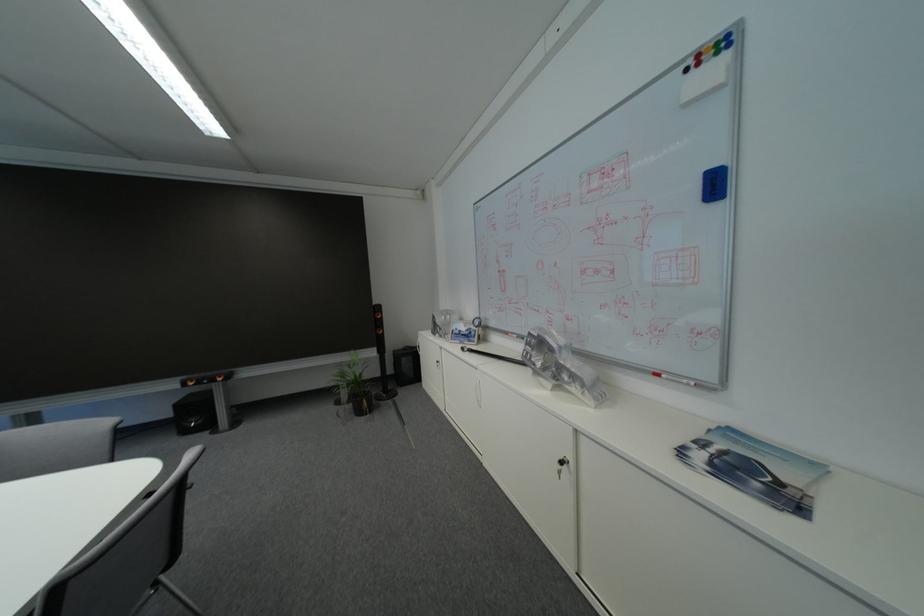
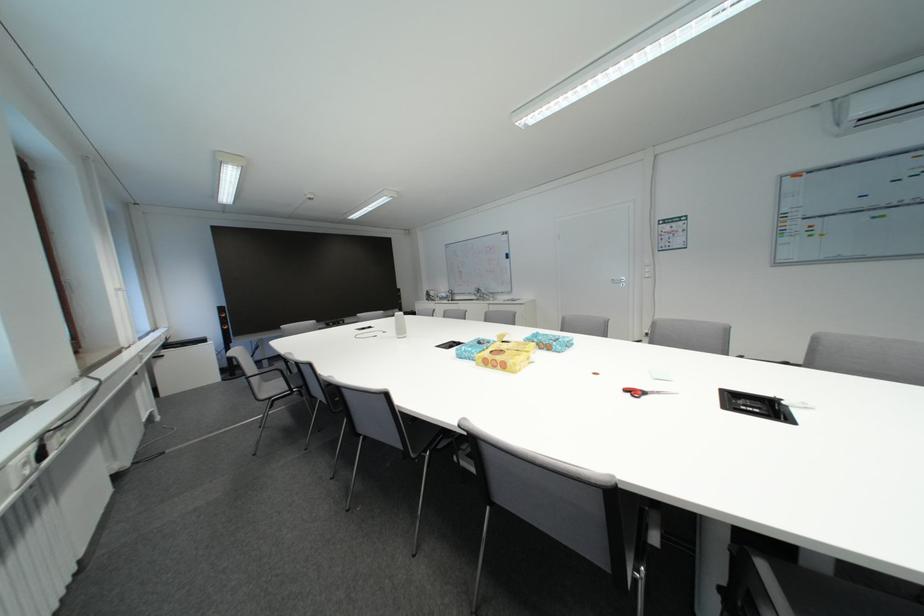
Find the pixel in the second image that matches (x=512, y=275) in the first image.

(470, 275)